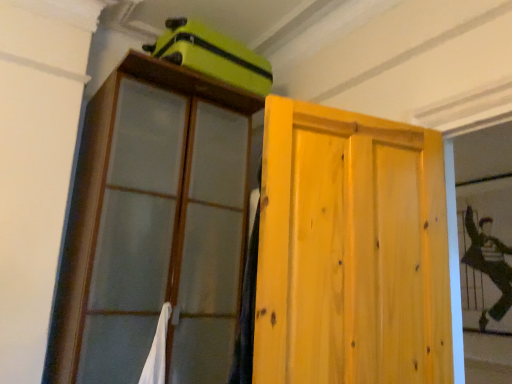
Question: Can silky black fabric at right be found inside matte green suitcase at upper center?

Choices:
 (A) no
 (B) yes

Answer: (A)

Question: Considering the relative sizes of matte green suitcase at upper center and silky black fabric at right in the image provided, is matte green suitcase at upper center bigger than silky black fabric at right?

Choices:
 (A) no
 (B) yes

Answer: (B)

Question: Is matte green suitcase at upper center oriented towards silky black fabric at right?

Choices:
 (A) no
 (B) yes

Answer: (A)

Question: From a real-world perspective, is matte green suitcase at upper center beneath silky black fabric at right?

Choices:
 (A) yes
 (B) no

Answer: (B)

Question: Is matte green suitcase at upper center taller than silky black fabric at right?

Choices:
 (A) no
 (B) yes

Answer: (A)

Question: Does matte green suitcase at upper center have a smaller size compared to silky black fabric at right?

Choices:
 (A) no
 (B) yes

Answer: (A)

Question: Is matte green suitcase at upper center at the back of wooden cabinet at upper left?

Choices:
 (A) yes
 (B) no

Answer: (B)

Question: Could matte green suitcase at upper center be considered to be inside wooden cabinet at upper left?

Choices:
 (A) yes
 (B) no

Answer: (B)

Question: Does wooden cabinet at upper left have a larger size compared to matte green suitcase at upper center?

Choices:
 (A) no
 (B) yes

Answer: (B)

Question: Considering the relative sizes of wooden cabinet at upper left and matte green suitcase at upper center in the image provided, is wooden cabinet at upper left thinner than matte green suitcase at upper center?

Choices:
 (A) yes
 (B) no

Answer: (B)

Question: Is wooden cabinet at upper left positioned before matte green suitcase at upper center?

Choices:
 (A) no
 (B) yes

Answer: (B)

Question: Can we say wooden cabinet at upper left lies outside matte green suitcase at upper center?

Choices:
 (A) yes
 (B) no

Answer: (A)

Question: Can you confirm if matte green suitcase at upper center is taller than light wood door at center?

Choices:
 (A) yes
 (B) no

Answer: (B)